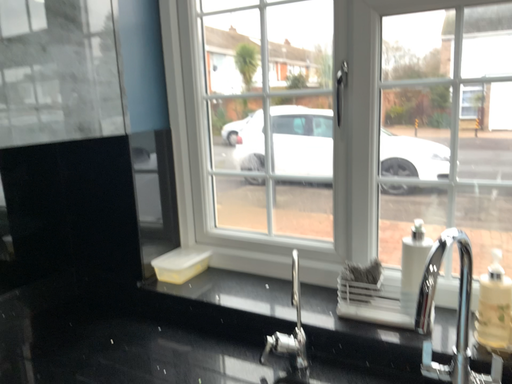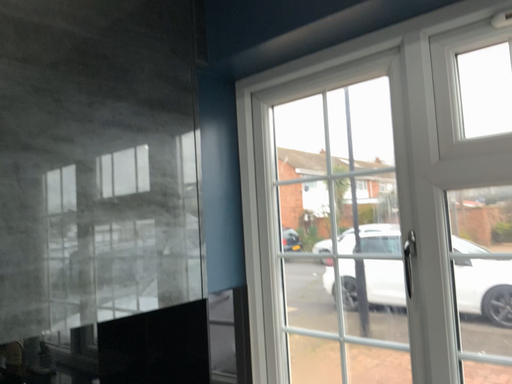
Question: How did the camera likely rotate when shooting the video?

Choices:
 (A) rotated downward
 (B) rotated upward

Answer: (B)